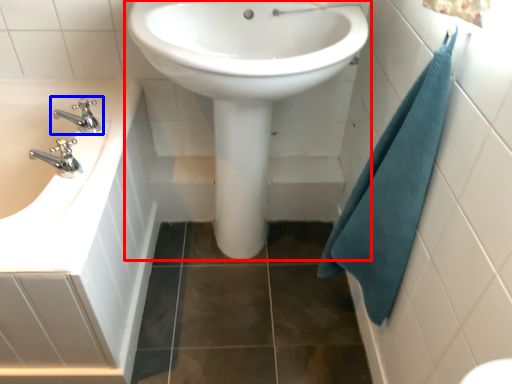
Question: Which point is further to the camera, sink (highlighted by a red box) or tap (highlighted by a blue box)?

Choices:
 (A) sink
 (B) tap

Answer: (B)